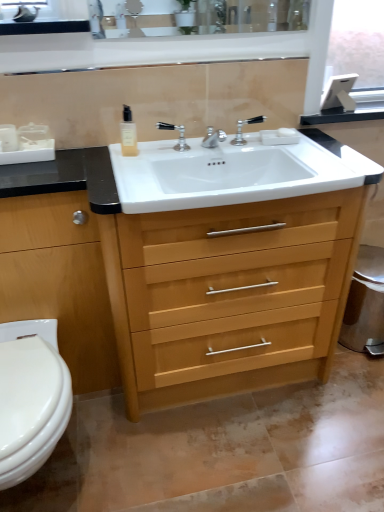
What are the coordinates of `vacant area that is in front of light wood/wooden vanity at center` in the screenshot? It's located at (232, 456).